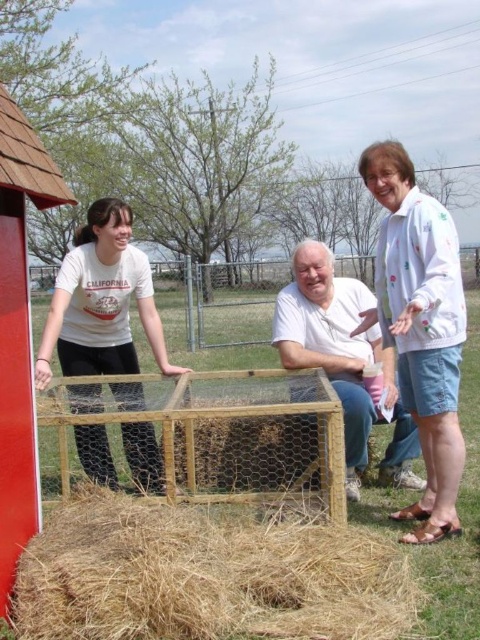
You are a photographer trying to capture a photo of the matte white shirt at center and the brown straw at lower center. Since you want both subjects to appear equally large in the photo, which subject should you move closer to the camera?

Since the brown straw at lower center is wider than the matte white shirt at center, you should move the brown straw at lower center closer to the camera to make them appear the same size in the photo.

You are a photographer standing at the back of the scene. You want to take a photo that includes both the white dotted jacket at upper right and the matte white shirt at center. Which object should you adjust your camera angle to focus on first to ensure both are in frame?

The white dotted jacket at upper right is much taller than the matte white shirt at center, so you should focus on the white dotted jacket at upper right first to ensure both are in frame.

You are standing at the center of the image. There is a point labeled at coordinates point (420, 326). Which object does this point correspond to?

The point (420, 326) corresponds to the white dotted jacket at upper right.